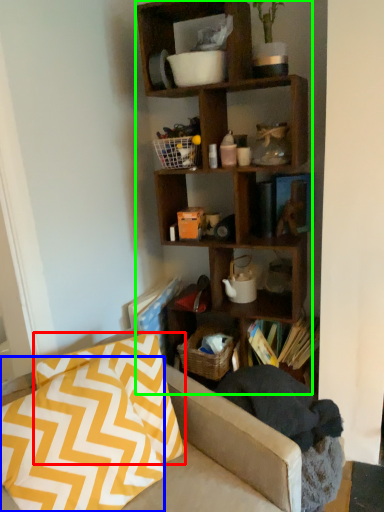
Question: Considering the real-world distances, which object is farthest from pillow (highlighted by a red box)? pillow (highlighted by a blue box) or shelf (highlighted by a green box)?

Choices:
 (A) pillow
 (B) shelf

Answer: (B)